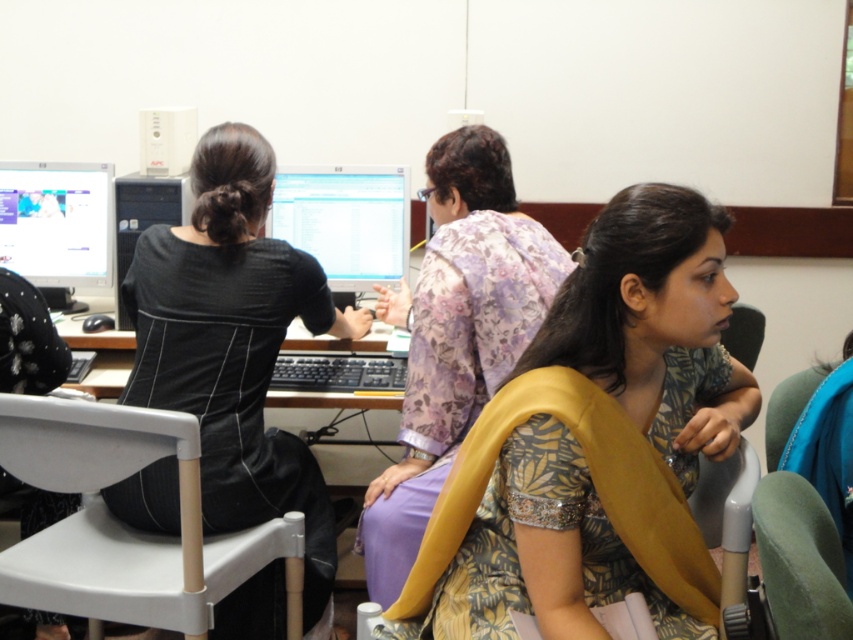
Question: Which object is farther from the camera taking this photo?

Choices:
 (A) green fabric chair at lower right
 (B) matte black monitor at left
 (C) black matte dress at center

Answer: (B)

Question: Among these objects, which one is nearest to the camera?

Choices:
 (A) matte plastic monitor at center
 (B) printed fabric blouse at center
 (C) floral fabric dress at center
 (D) green fabric chair at lower right

Answer: (D)

Question: Can you confirm if matte plastic monitor at center is positioned below green fabric chair at lower right?

Choices:
 (A) no
 (B) yes

Answer: (A)

Question: Is white plastic chair at lower left thinner than matte black monitor at left?

Choices:
 (A) no
 (B) yes

Answer: (A)

Question: Which of the following is the farthest from the observer?

Choices:
 (A) pyautogui.click(x=45, y=248)
 (B) pyautogui.click(x=689, y=323)

Answer: (A)

Question: In this image, where is floral fabric dress at center located relative to green fabric chair at lower right?

Choices:
 (A) left
 (B) right

Answer: (A)